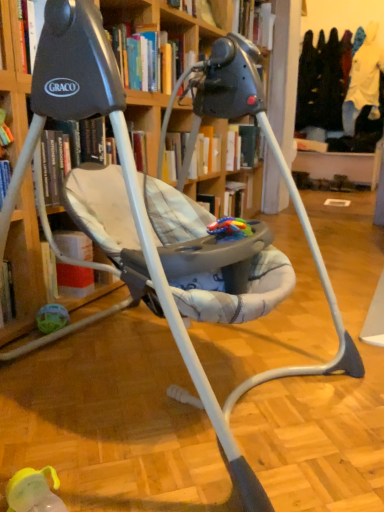
Question: Is hardcover book at upper center, the 2th book when ordered from top to bottom, to the left or to the right of hardcover book at upper center, the first book viewed from the back, in the image?

Choices:
 (A) left
 (B) right

Answer: (A)

Question: Considering the positions of point (198, 10) and point (269, 15), is point (198, 10) closer or farther from the camera than point (269, 15)?

Choices:
 (A) closer
 (B) farther

Answer: (A)

Question: Which is farther from the hardcover book at upper center, which is the third book in left-to-right order?

Choices:
 (A) hardcover book at upper center, which appears as the 2th book when viewed from the back
 (B) hardcover book at upper center, which appears as the 3th book when viewed from the back

Answer: (B)

Question: Which of these objects is positioned closest to the hardcover book at upper center, which ranks as the 3th book in top-to-bottom order?

Choices:
 (A) hardcover book at upper center, which ranks as the second book in bottom-to-top order
 (B) hardcover book at upper center, positioned as the third book in bottom-to-top order

Answer: (A)